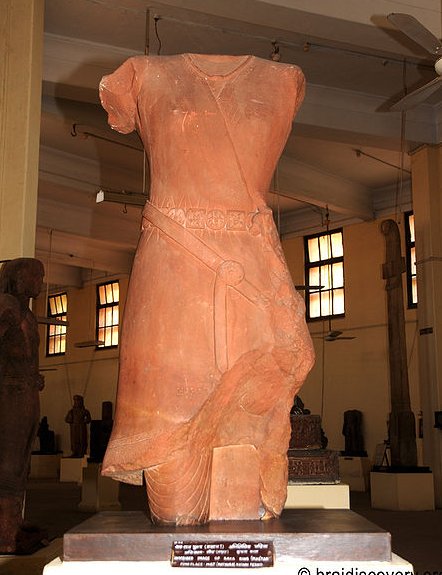
At what (x,y) coordinates should I click in order to perform the action: click on pillar. Please return your answer as a coordinate pair (x, y). Looking at the image, I should click on (397, 329).